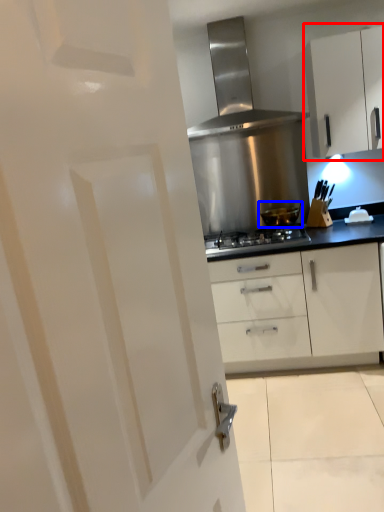
Question: Which object appears farthest to the camera in this image, cabinetry (highlighted by a red box) or kitchen appliance (highlighted by a blue box)?

Choices:
 (A) cabinetry
 (B) kitchen appliance

Answer: (B)